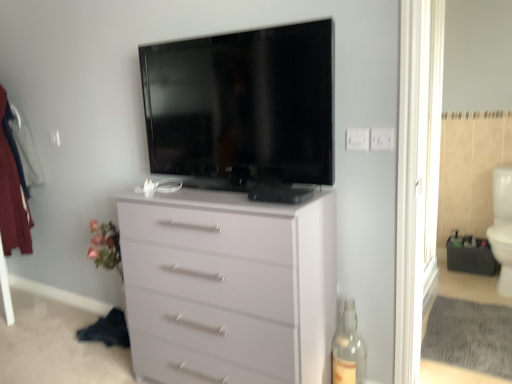
Question: Should I look upward or downward to see white plastic electric outlet at upper right, which ranks as the second electric outlet in right-to-left order?

Choices:
 (A) down
 (B) up

Answer: (B)

Question: From a real-world perspective, is white glossy toilet bowl at right positioned over white plastic electric outlet at upper right, positioned as the first electric outlet in right-to-left order, based on gravity?

Choices:
 (A) yes
 (B) no

Answer: (B)

Question: Can white plastic electric outlet at upper right, which appears as the 2th electric outlet when viewed from the left, be found inside white glossy toilet bowl at right?

Choices:
 (A) yes
 (B) no

Answer: (B)

Question: Considering the relative positions of white glossy toilet bowl at right and white plastic electric outlet at upper right, positioned as the first electric outlet in right-to-left order, in the image provided, is white glossy toilet bowl at right to the right of white plastic electric outlet at upper right, positioned as the first electric outlet in right-to-left order, from the viewer's perspective?

Choices:
 (A) no
 (B) yes

Answer: (B)

Question: Can you confirm if white glossy toilet bowl at right is wider than white plastic electric outlet at upper right, which appears as the 2th electric outlet when viewed from the left?

Choices:
 (A) yes
 (B) no

Answer: (A)

Question: From the image's perspective, does white glossy toilet bowl at right appear lower than white plastic electric outlet at upper right, positioned as the first electric outlet in right-to-left order?

Choices:
 (A) no
 (B) yes

Answer: (B)

Question: Is white glossy toilet bowl at right turned away from white plastic electric outlet at upper right, which appears as the 2th electric outlet when viewed from the left?

Choices:
 (A) yes
 (B) no

Answer: (B)

Question: Is flat screen tv at upper center turned away from white plastic electric outlet at upper right, which appears as the first electric outlet when viewed from the left?

Choices:
 (A) yes
 (B) no

Answer: (A)

Question: Is the depth of flat screen tv at upper center less than that of white plastic electric outlet at upper right, which appears as the first electric outlet when viewed from the left?

Choices:
 (A) no
 (B) yes

Answer: (B)

Question: From the image's perspective, is flat screen tv at upper center on white plastic electric outlet at upper right, which ranks as the second electric outlet in right-to-left order?

Choices:
 (A) no
 (B) yes

Answer: (B)

Question: Is flat screen tv at upper center outside of white plastic electric outlet at upper right, which appears as the first electric outlet when viewed from the left?

Choices:
 (A) yes
 (B) no

Answer: (A)

Question: Is flat screen tv at upper center not near white plastic electric outlet at upper right, which ranks as the second electric outlet in right-to-left order?

Choices:
 (A) yes
 (B) no

Answer: (B)

Question: Considering the relative sizes of flat screen tv at upper center and white plastic electric outlet at upper right, which ranks as the second electric outlet in right-to-left order, in the image provided, is flat screen tv at upper center wider than white plastic electric outlet at upper right, which ranks as the second electric outlet in right-to-left order,?

Choices:
 (A) yes
 (B) no

Answer: (A)

Question: Can white glossy toilet bowl at right be found inside transparent glass door at right?

Choices:
 (A) yes
 (B) no

Answer: (B)